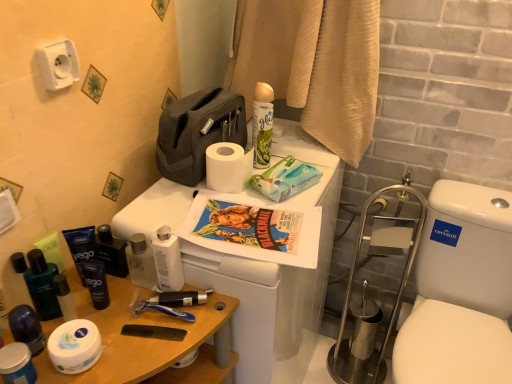
The image size is (512, 384). I want to click on spots to the right of white matte toilet paper at lower left, the 2th toilet paper in the top-to-bottom sequence, so click(150, 344).